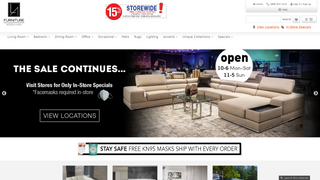
I want to click on beige sectional, so click(157, 89).